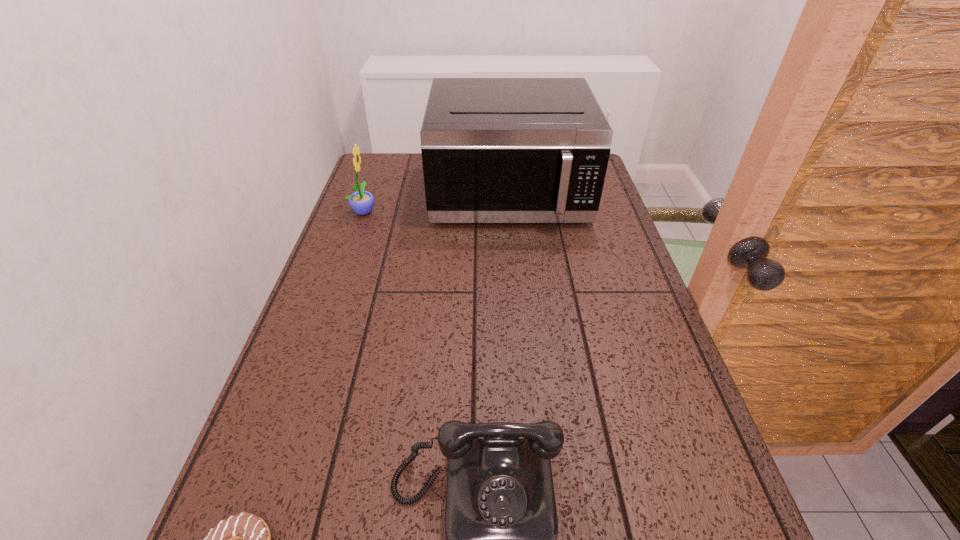
Where is `microwave_oven`? Image resolution: width=960 pixels, height=540 pixels. microwave_oven is located at coordinates (494, 150).

Identify the location of sunflower. (361, 202).

Find the location of a particular element. The width and height of the screenshot is (960, 540). vacant region located on the front-facing side of the tallest object is located at coordinates (520, 325).

Find the location of a particular element. free space located on the front-facing side of the second tallest object is located at coordinates (457, 211).

You are a GUI agent. You are given a task and a screenshot of the screen. Output one action in this format:
    pyautogui.click(x=<x>, y=<y>)
    Task: Click on the object situated at the far edge
    
    Given the screenshot: What is the action you would take?
    pyautogui.click(x=494, y=150)

Image resolution: width=960 pixels, height=540 pixels. In order to click on object that is at the left edge in this screenshot , I will do `click(361, 202)`.

Identify the location of object that is at the right edge. The image size is (960, 540). (494, 150).

Identify the location of object at the far right corner. (494, 150).

Image resolution: width=960 pixels, height=540 pixels. In order to click on free space at the left edge in this screenshot , I will do `click(324, 478)`.

At what (x,y) coordinates should I click in order to perform the action: click on free region at the right edge of the desktop. Please return your answer as a coordinate pair (x, y). The width and height of the screenshot is (960, 540). Looking at the image, I should click on (618, 280).